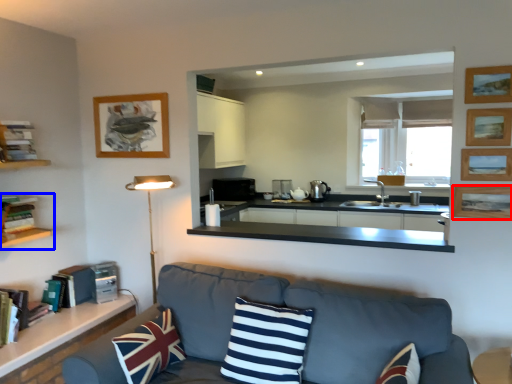
Question: Which object is further to the camera taking this photo, picture frame (highlighted by a red box) or shelf (highlighted by a blue box)?

Choices:
 (A) picture frame
 (B) shelf

Answer: (B)